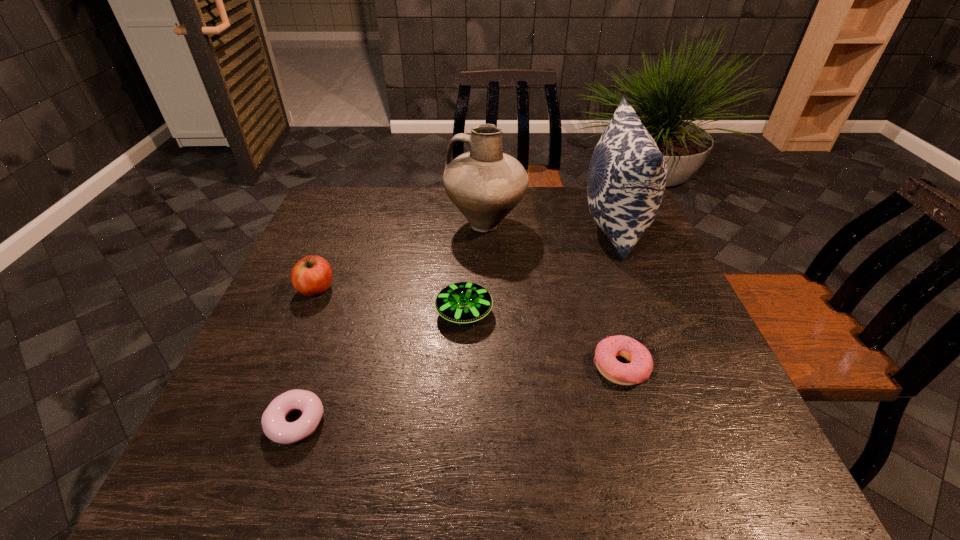
Find the location of a particular element. vacant area that lies between the left doughnut and the cushion is located at coordinates (454, 324).

Locate an element on the screen. The height and width of the screenshot is (540, 960). blank region between the second nearest object and the third shortest object is located at coordinates (542, 340).

Where is `the fifth closest object relative to the nearest object`? This screenshot has width=960, height=540. the fifth closest object relative to the nearest object is located at coordinates (627, 174).

You are a GUI agent. You are given a task and a screenshot of the screen. Output one action in this format:
    pyautogui.click(x=<x>, y=<y>)
    Task: Click on the object that is the fourth closest one to the saucer
    The height and width of the screenshot is (540, 960).
    Given the screenshot: What is the action you would take?
    pyautogui.click(x=312, y=275)

Locate an element on the screen. The width and height of the screenshot is (960, 540). vacant space that satisfies the following two spatial constraints: 1. on the handle side of the pitcher; 2. on the front side of the nearest object is located at coordinates (489, 422).

Locate an element on the screen. Image resolution: width=960 pixels, height=540 pixels. vacant space that satisfies the following two spatial constraints: 1. on the handle side of the pitcher; 2. on the front side of the fourth shortest object is located at coordinates (487, 289).

This screenshot has height=540, width=960. In order to click on free spot that satisfies the following two spatial constraints: 1. on the handle side of the pitcher; 2. on the front side of the third shortest object in this screenshot , I will do `click(487, 312)`.